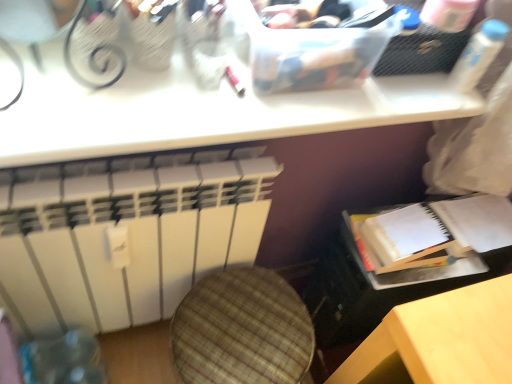
Find the location of a particular element. Image resolution: width=512 pixels, height=384 pixels. free location in front of white plastic bottle at upper right is located at coordinates (446, 104).